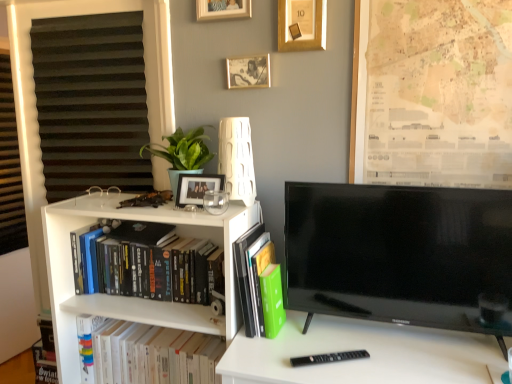
Where is `vacant location below black glossy tv at right (from a real-world perspective)`? vacant location below black glossy tv at right (from a real-world perspective) is located at coordinates (396, 337).